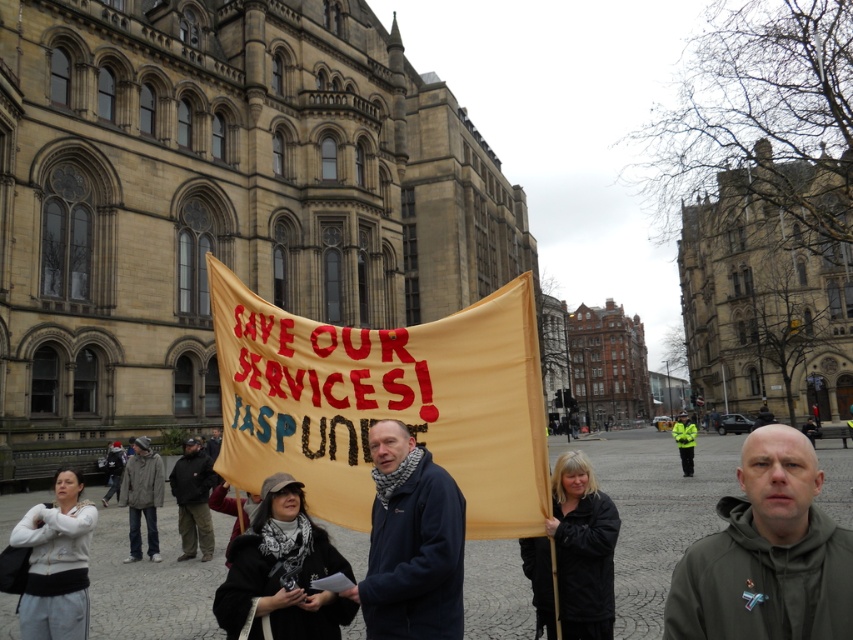
Question: Observing the image, what is the correct spatial positioning of dark green hoodie at center in reference to gray woolen jacket at lower left?

Choices:
 (A) above
 (B) below

Answer: (B)

Question: Can you confirm if gray woolen jacket at lower left is bigger than high visibility jacket at center?

Choices:
 (A) no
 (B) yes

Answer: (A)

Question: Which of the following is the farthest from the observer?

Choices:
 (A) dark green hoodie at center
 (B) high visibility jacket at center
 (C) dark brown leather jacket at center
 (D) gray woolen jacket at lower left

Answer: (B)

Question: Is dark blue jacket at center wider than gray woolen jacket at lower left?

Choices:
 (A) yes
 (B) no

Answer: (B)

Question: Based on their relative distances, which object is farther from the gray woolen jacket at lower left?

Choices:
 (A) dark green hoodie at center
 (B) dark brown leather jacket at center

Answer: (A)

Question: Based on their relative distances, which object is nearer to the dark blue jacket at center?

Choices:
 (A) gray woolen jacket at lower left
 (B) dark brown leather jacket at center
 (C) dark green hoodie at center
 (D) yellow fabric banner at center

Answer: (D)